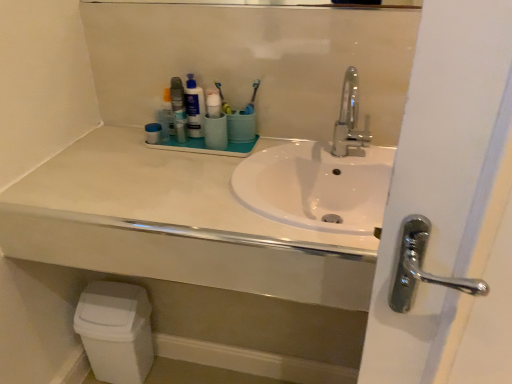
Identify the location of vacant area that is situated to the right of matte blue cup at center, the third toiletry when ordered from left to right. Image resolution: width=512 pixels, height=384 pixels. (276, 142).